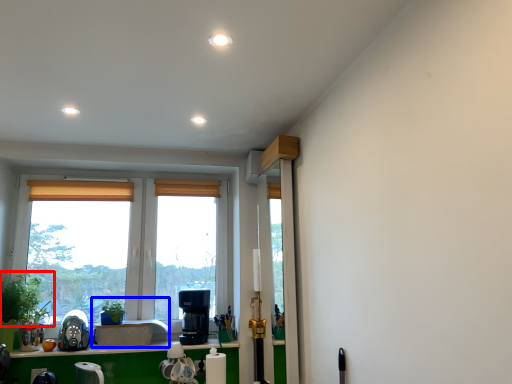
Question: Among these objects, which one is nearest to the camera, plant (highlighted by a red box) or sink (highlighted by a blue box)?

Choices:
 (A) plant
 (B) sink

Answer: (A)